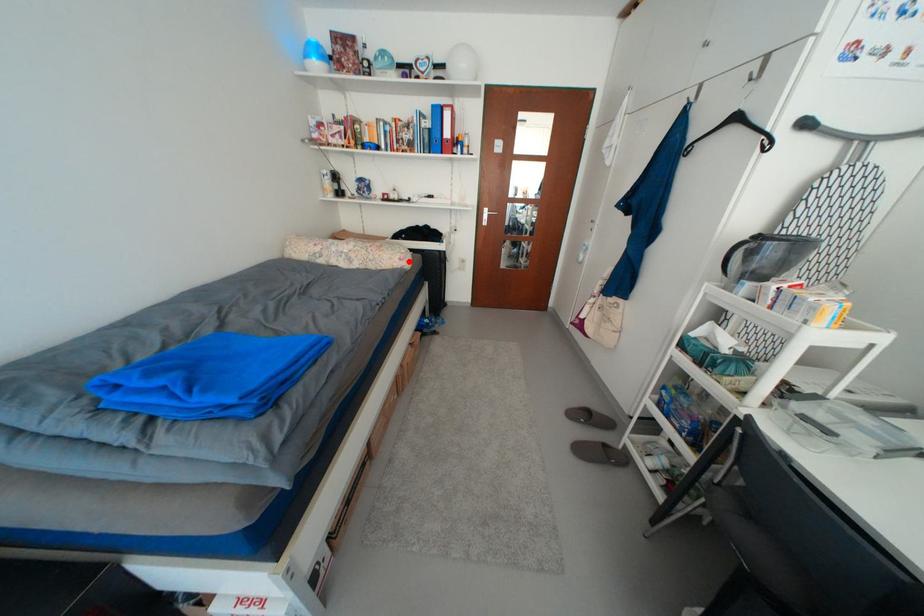
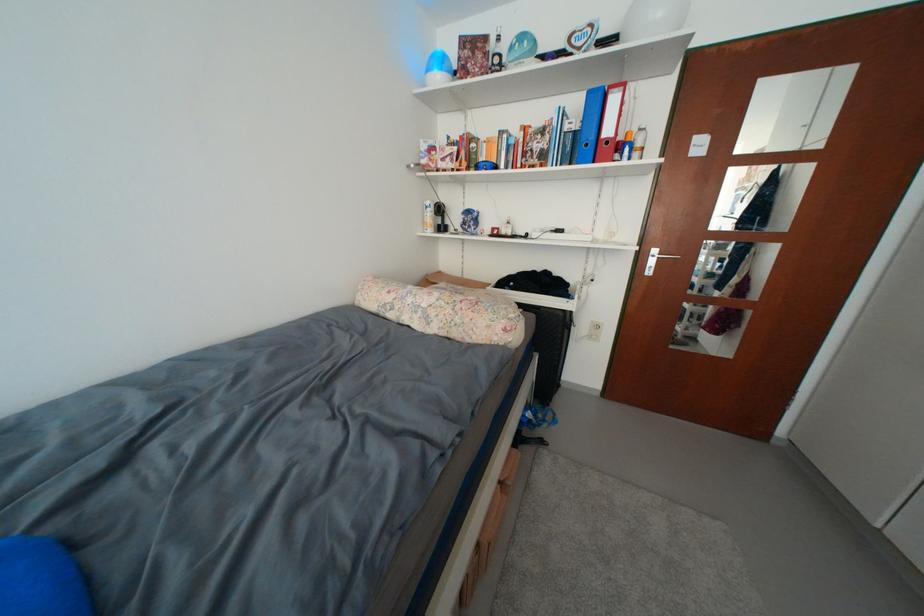
The point at the highlighted location is marked in the first image. Where is the corresponding point in the second image?

(514, 331)